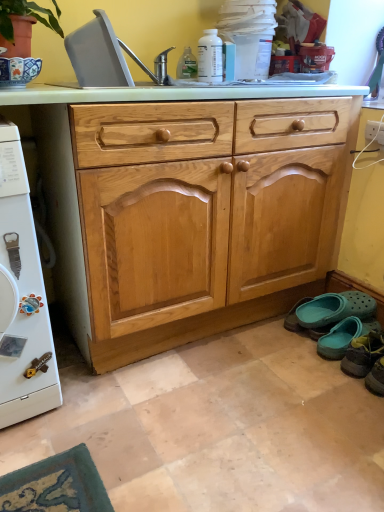
Question: Is teal fabric slipper at lower right, which is the 1th footwear in front-to-back order, far away from light wood drawer at center?

Choices:
 (A) no
 (B) yes

Answer: (A)

Question: Is teal fabric slipper at lower right, which is the 1th footwear in front-to-back order, facing away from light wood drawer at center?

Choices:
 (A) yes
 (B) no

Answer: (B)

Question: Can you confirm if teal fabric slipper at lower right, positioned as the 2th footwear in back-to-front order, is thinner than light wood drawer at center?

Choices:
 (A) no
 (B) yes

Answer: (B)

Question: Could you tell me if teal fabric slipper at lower right, positioned as the 2th footwear in back-to-front order, is facing light wood drawer at center?

Choices:
 (A) yes
 (B) no

Answer: (B)

Question: Is teal fabric slipper at lower right, which is the 1th footwear in front-to-back order, in front of light wood drawer at center?

Choices:
 (A) no
 (B) yes

Answer: (A)

Question: Is teal fabric slipper at lower right, positioned as the 2th footwear in back-to-front order, directly adjacent to light wood drawer at center?

Choices:
 (A) no
 (B) yes

Answer: (A)

Question: Is the depth of gray plastic sink at upper left less than that of teal fabric slipper at lower right, positioned as the 2th footwear in back-to-front order?

Choices:
 (A) yes
 (B) no

Answer: (A)

Question: Is gray plastic sink at upper left looking in the opposite direction of teal fabric slipper at lower right, which is the 1th footwear in front-to-back order?

Choices:
 (A) no
 (B) yes

Answer: (A)

Question: Does gray plastic sink at upper left have a greater height compared to teal fabric slipper at lower right, which is the 1th footwear in front-to-back order?

Choices:
 (A) no
 (B) yes

Answer: (B)

Question: Is gray plastic sink at upper left touching teal fabric slipper at lower right, positioned as the 2th footwear in back-to-front order?

Choices:
 (A) yes
 (B) no

Answer: (B)

Question: Is gray plastic sink at upper left at the left side of teal fabric slipper at lower right, positioned as the 2th footwear in back-to-front order?

Choices:
 (A) yes
 (B) no

Answer: (A)

Question: Is gray plastic sink at upper left positioned far away from teal fabric slipper at lower right, which is the 1th footwear in front-to-back order?

Choices:
 (A) yes
 (B) no

Answer: (A)

Question: Considering the relative positions of light wood drawer at center and gray plastic sink at upper left in the image provided, is light wood drawer at center in front of gray plastic sink at upper left?

Choices:
 (A) yes
 (B) no

Answer: (A)